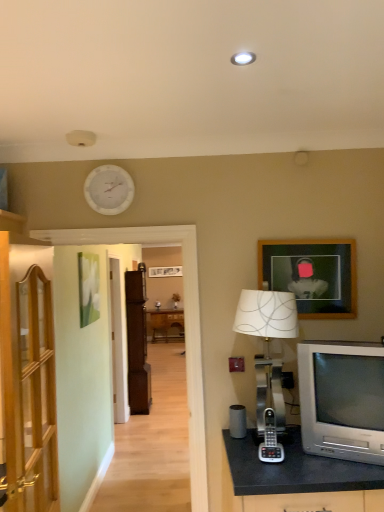
You are a GUI agent. You are given a task and a screenshot of the screen. Output one action in this format:
    pyautogui.click(x=<x>, y=<y>)
    Task: Click on the blank space situated above wooden picture frame at upper right (from a real-world perspective)
    Image resolution: width=384 pixels, height=512 pixels.
    Given the screenshot: What is the action you would take?
    pyautogui.click(x=312, y=232)